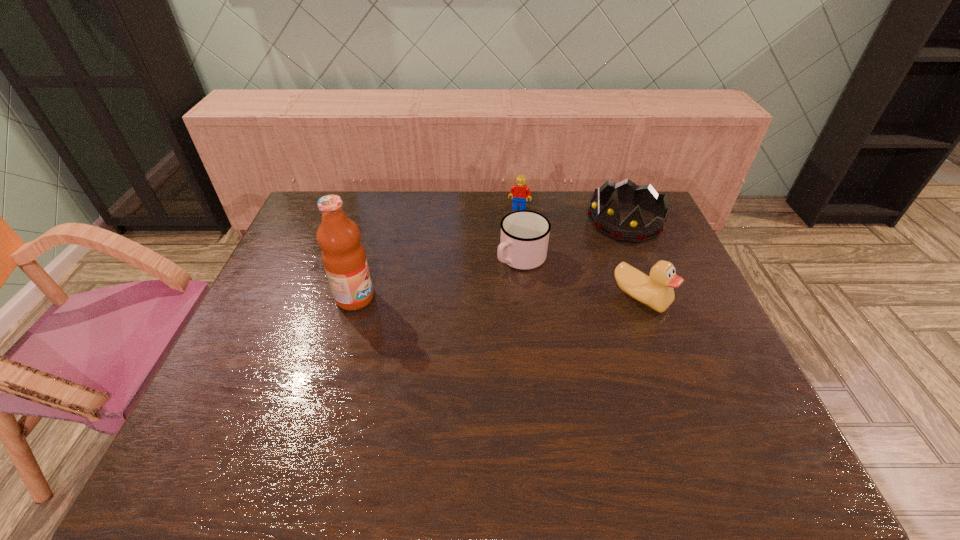
The width and height of the screenshot is (960, 540). Identify the location of fruit juice. (344, 259).

You are a GUI agent. You are given a task and a screenshot of the screen. Output one action in this format:
    pyautogui.click(x=<x>, y=<y>)
    Task: Click on the leftmost object
    Image resolution: width=960 pixels, height=540 pixels.
    Given the screenshot: What is the action you would take?
    pyautogui.click(x=344, y=259)

Identify the location of duck. (656, 291).

This screenshot has height=540, width=960. I want to click on Lego, so click(x=519, y=192).

At what (x,y) coordinates should I click in order to perform the action: click on mug. Please return your answer as a coordinate pair (x, y). Looking at the image, I should click on (524, 239).

Where is `tiara`? The width and height of the screenshot is (960, 540). tiara is located at coordinates (632, 229).

The width and height of the screenshot is (960, 540). I want to click on vacant space located on the front label of the fruit juice, so click(x=393, y=298).

You are a GUI agent. You are given a task and a screenshot of the screen. Output one action in this format:
    pyautogui.click(x=<x>, y=<y>)
    Task: Click on the blank area located at the beak of the duck
    The width and height of the screenshot is (960, 540).
    Given the screenshot: What is the action you would take?
    pyautogui.click(x=672, y=383)

In order to click on free space located 0.250m on the face of the Lego in this screenshot , I will do `click(502, 256)`.

The image size is (960, 540). In order to click on vacant space located 0.370m on the face of the Lego in this screenshot , I will do `click(493, 283)`.